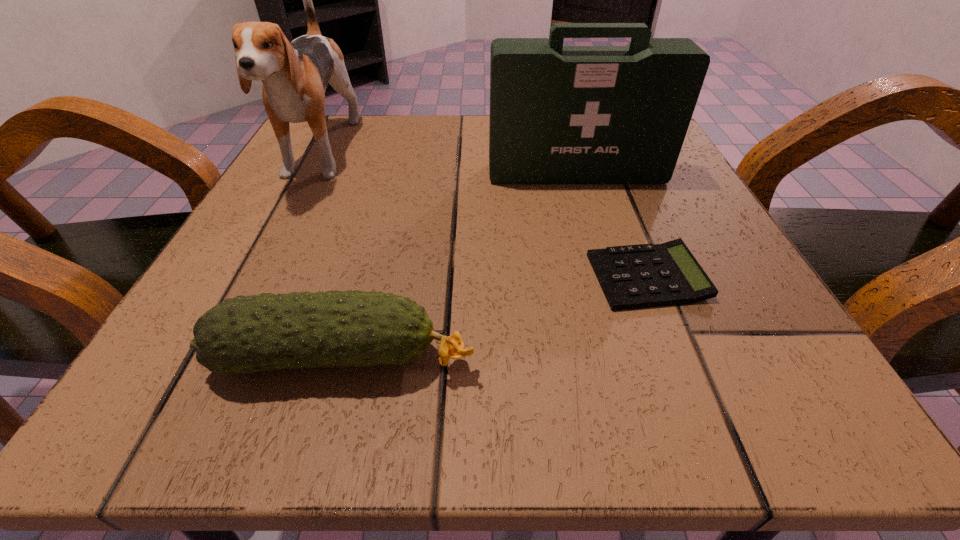
At what (x,y) coordinates should I click in order to perform the action: click on the tallest object. Please return your answer as a coordinate pair (x, y). Looking at the image, I should click on (295, 75).

Locate an element on the screen. the second tallest object is located at coordinates (559, 114).

Find the location of a particular element. The image size is (960, 540). the third tallest object is located at coordinates (245, 334).

Locate an element on the screen. The width and height of the screenshot is (960, 540). the nearest object is located at coordinates (245, 334).

The image size is (960, 540). In order to click on the third farthest object in this screenshot , I will do `click(638, 276)`.

Where is `calculator`? This screenshot has width=960, height=540. calculator is located at coordinates (638, 276).

Where is `free space located 0.160m at the face of the tallest object`? free space located 0.160m at the face of the tallest object is located at coordinates (257, 274).

This screenshot has width=960, height=540. Find the location of `free space located 0.290m on the front-facing side of the second tallest object`. free space located 0.290m on the front-facing side of the second tallest object is located at coordinates (616, 309).

This screenshot has width=960, height=540. I want to click on vacant area situated at the blossom end of the second shortest object, so click(624, 357).

At what (x,y) coordinates should I click in order to perform the action: click on free space located on the left of the third farthest object. Please return your answer as a coordinate pair (x, y). Looking at the image, I should click on (459, 277).